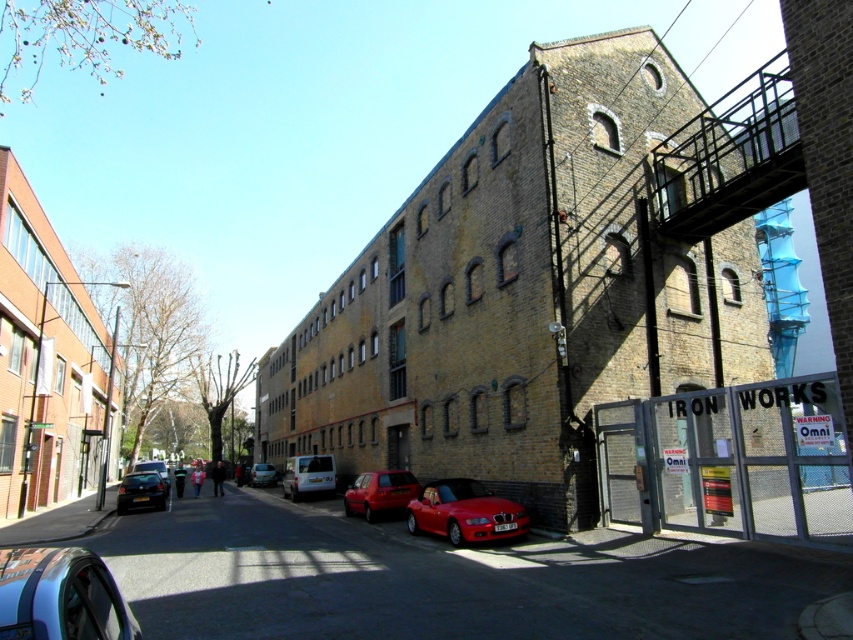
Is matte red van at center wider than white matte van at center?

No, matte red van at center is not wider than white matte van at center.

Which of these two, matte red van at center or white matte van at center, stands shorter?

Standing shorter between the two is matte red van at center.

Which is in front, point (346, 508) or point (325, 484)?

Positioned in front is point (346, 508).

Find the location of a particular element. matte red van at center is located at coordinates (379, 492).

Is shiny blue car at lower left bigger than white matte van at center?

No, shiny blue car at lower left is not bigger than white matte van at center.

Who is more forward, (136, 628) or (299, 477)?

Point (136, 628) is in front.

In order to click on shiny blue car at lower left in this screenshot , I will do point(61,596).

Measure the distance between shiny blue car at lower left and camera.

shiny blue car at lower left and camera are 1.94 meters apart.

Does shiny blue car at lower left have a larger size compared to metallic silver van at center?

Incorrect, shiny blue car at lower left is not larger than metallic silver van at center.

What are the coordinates of `shiny blue car at lower left` in the screenshot? It's located at (61, 596).